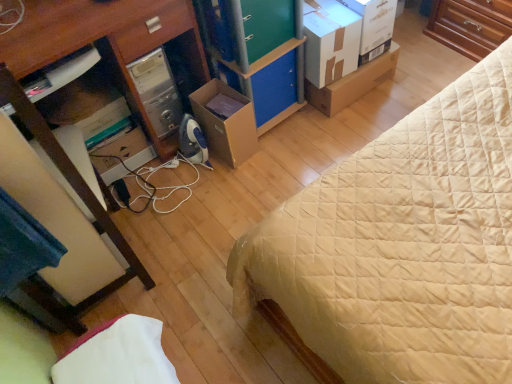
Question: Can you confirm if brown wood dresser at upper right is taller than green matte drawer at center, placed as the first drawer when sorted from top to bottom?

Choices:
 (A) no
 (B) yes

Answer: (B)

Question: Does brown wood dresser at upper right appear on the right side of green matte drawer at center, the second drawer when ordered from bottom to top?

Choices:
 (A) yes
 (B) no

Answer: (A)

Question: Is brown wood dresser at upper right beside green matte drawer at center, placed as the first drawer when sorted from top to bottom?

Choices:
 (A) no
 (B) yes

Answer: (A)

Question: Considering the relative sizes of brown wood dresser at upper right and green matte drawer at center, the second drawer when ordered from bottom to top, in the image provided, is brown wood dresser at upper right shorter than green matte drawer at center, the second drawer when ordered from bottom to top,?

Choices:
 (A) yes
 (B) no

Answer: (B)

Question: From a real-world perspective, is brown wood dresser at upper right located beneath green matte drawer at center, placed as the first drawer when sorted from top to bottom?

Choices:
 (A) yes
 (B) no

Answer: (A)

Question: Is brown wood dresser at upper right thinner than green matte drawer at center, the second drawer when ordered from bottom to top?

Choices:
 (A) yes
 (B) no

Answer: (B)

Question: From the image's perspective, does wooden desk at left appear lower than green matte drawer at center, placed as the first drawer when sorted from top to bottom?

Choices:
 (A) yes
 (B) no

Answer: (A)

Question: Is wooden desk at left bigger than green matte drawer at center, placed as the first drawer when sorted from top to bottom?

Choices:
 (A) no
 (B) yes

Answer: (B)

Question: Can you confirm if wooden desk at left is thinner than green matte drawer at center, the second drawer when ordered from bottom to top?

Choices:
 (A) no
 (B) yes

Answer: (A)

Question: Is wooden desk at left with green matte drawer at center, the second drawer when ordered from bottom to top?

Choices:
 (A) no
 (B) yes

Answer: (A)

Question: Is wooden desk at left behind green matte drawer at center, the second drawer when ordered from bottom to top?

Choices:
 (A) no
 (B) yes

Answer: (A)

Question: Is wooden desk at left looking in the opposite direction of green matte drawer at center, placed as the first drawer when sorted from top to bottom?

Choices:
 (A) yes
 (B) no

Answer: (B)

Question: Considering the relative positions of beige quilted bed at center and wooden desk at left in the image provided, is beige quilted bed at center to the right of wooden desk at left from the viewer's perspective?

Choices:
 (A) no
 (B) yes

Answer: (B)